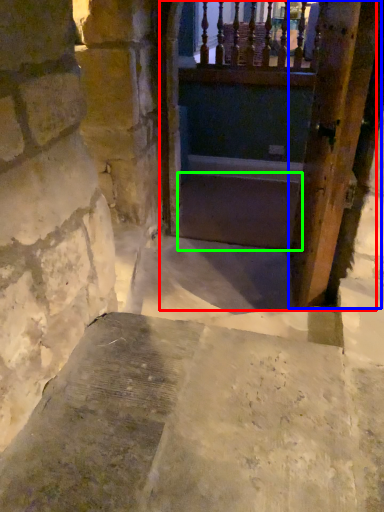
Question: Considering the real-world distances, which object is closest to tunnel (highlighted by a red box)? door (highlighted by a blue box) or stairs (highlighted by a green box).

Choices:
 (A) door
 (B) stairs

Answer: (B)